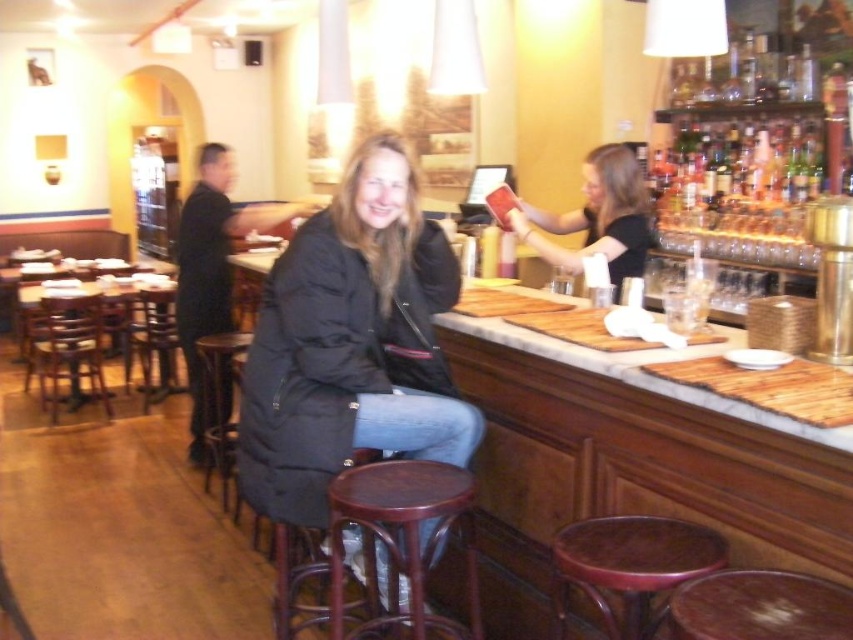
You are a bartender preparing to place a tray of drinks on the bar counter. You need to ensure there is enough space between the mahogany wood bar stool at center and the wooden stool at lower right to avoid knocking over the drinks. Which direction should you place the tray to keep it away from both stools?

The mahogany wood bar stool at center is positioned under the wooden stool at lower right, meaning they are stacked vertically. To keep the tray away from both, place it on the side opposite to where the stools are aligned, ensuring it is not between them or near their positions.

You are a bartender preparing to arrange items on the bar counter. You have the black matte jacket at center and the translucent glass bottles at upper right. Which item should you place first if you want to prioritize the wider object?

A: The black matte jacket at center should be placed first because its width surpasses the translucent glass bottles at upper right, making it the wider object.

You are standing at the entrance of the bar and see two points marked in the scene. Which point, point (430,480) or point (787,592), is closer to you?

Point (430,480) is further to the camera than point (787,592), so the closer point to you is point (787,592).